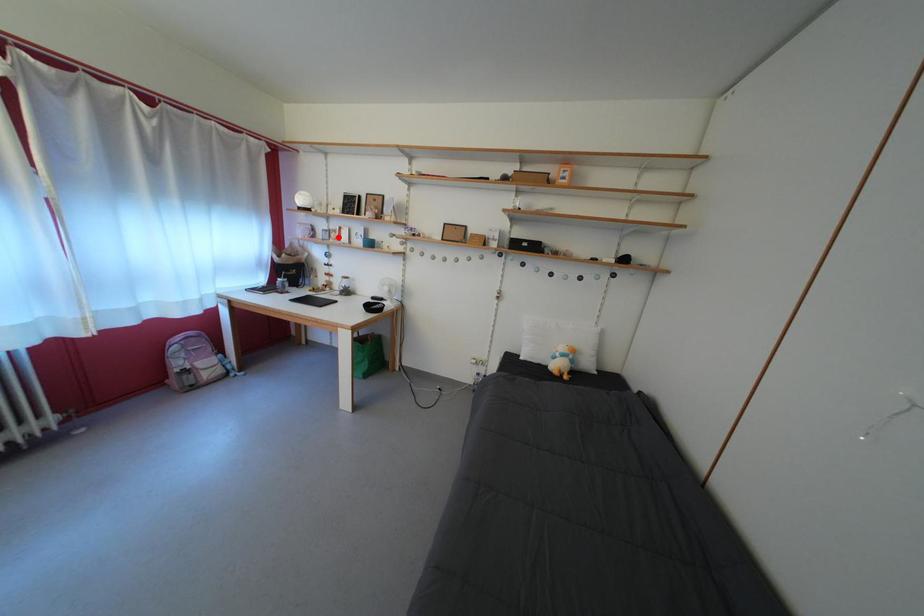
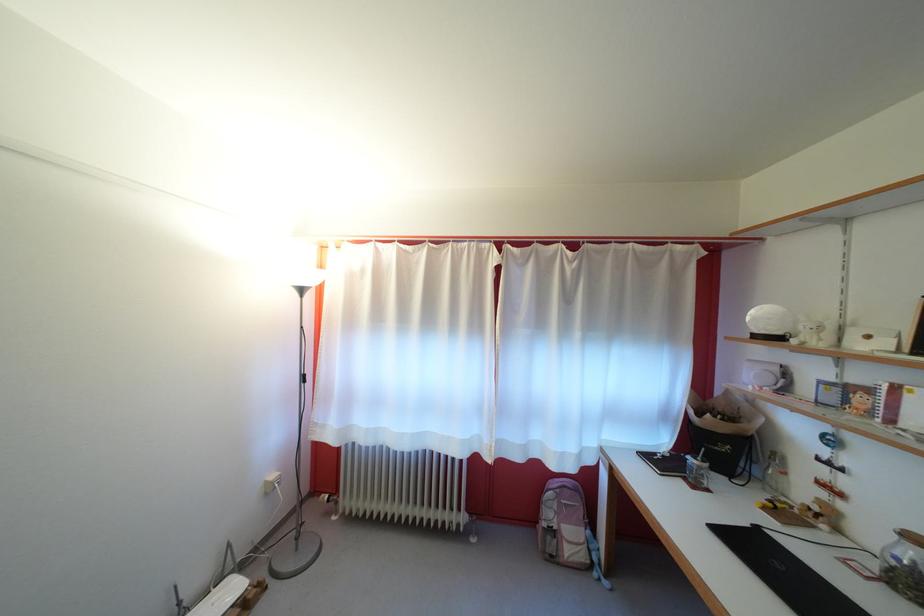
Where in the second image is the point corresponding to the highlighted location from the first image?

(855, 395)